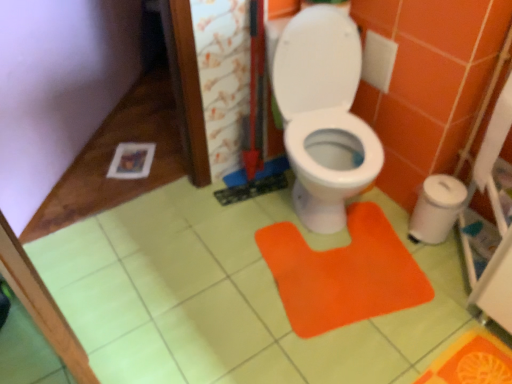
Question: Considering the relative sizes of orange fabric doormat at center and white paper at right in the image provided, is orange fabric doormat at center shorter than white paper at right?

Choices:
 (A) yes
 (B) no

Answer: (A)

Question: Is orange fabric doormat at center looking in the opposite direction of white paper at right?

Choices:
 (A) yes
 (B) no

Answer: (B)

Question: Is orange fabric doormat at center to the right of white paper at right from the viewer's perspective?

Choices:
 (A) yes
 (B) no

Answer: (B)

Question: From a real-world perspective, is orange fabric doormat at center over white paper at right?

Choices:
 (A) yes
 (B) no

Answer: (B)

Question: Considering the relative sizes of orange fabric doormat at center and white paper at right in the image provided, is orange fabric doormat at center taller than white paper at right?

Choices:
 (A) no
 (B) yes

Answer: (A)

Question: From their relative heights in the image, would you say orange fabric doormat at center is taller or shorter than white plastic trash can at right?

Choices:
 (A) tall
 (B) short

Answer: (B)

Question: Based on their sizes in the image, would you say orange fabric doormat at center is bigger or smaller than white plastic trash can at right?

Choices:
 (A) small
 (B) big

Answer: (B)

Question: In terms of width, does orange fabric doormat at center look wider or thinner when compared to white plastic trash can at right?

Choices:
 (A) wide
 (B) thin

Answer: (A)

Question: Is point (354, 225) closer or farther from the camera than point (426, 243)?

Choices:
 (A) closer
 (B) farther

Answer: (B)

Question: Considering the positions of white paper at right and orange fabric doormat at center in the image, is white paper at right taller or shorter than orange fabric doormat at center?

Choices:
 (A) tall
 (B) short

Answer: (A)

Question: In the image, is white paper at right on the left side or the right side of orange fabric doormat at center?

Choices:
 (A) left
 (B) right

Answer: (B)

Question: From a real-world perspective, is white paper at right above or below orange fabric doormat at center?

Choices:
 (A) below
 (B) above

Answer: (B)

Question: In terms of width, does white paper at right look wider or thinner when compared to orange fabric doormat at center?

Choices:
 (A) wide
 (B) thin

Answer: (B)

Question: In the image, is white plastic trash can at right on the left side or the right side of orange fabric doormat at center?

Choices:
 (A) left
 (B) right

Answer: (B)

Question: Considering the positions of white plastic trash can at right and orange fabric doormat at center in the image, is white plastic trash can at right taller or shorter than orange fabric doormat at center?

Choices:
 (A) tall
 (B) short

Answer: (A)